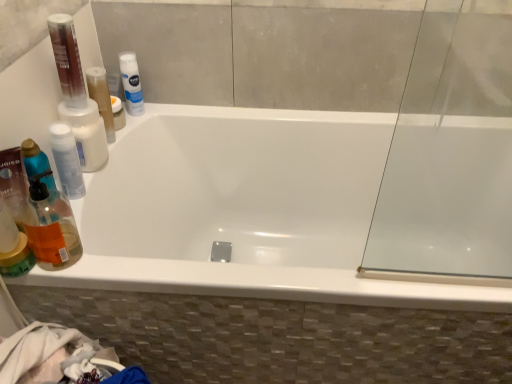
Question: From the image's perspective, is white matte nivea spray at upper center, which is the 3th mouthwash in front-to-back order, above or below white opaque bottle at upper left, which is counted as the second mouthwash, starting from the back?

Choices:
 (A) below
 (B) above

Answer: (B)

Question: Does point (137, 94) appear closer or farther from the camera than point (112, 130)?

Choices:
 (A) closer
 (B) farther

Answer: (B)

Question: Which of these objects is positioned farthest from the white glossy bathtub at center?

Choices:
 (A) white matte nivea spray at upper center, acting as the 1th mouthwash starting from the back
 (B) transparent plastic bottle at left, which ranks as the 3th mouthwash in back-to-front order
 (C) white opaque bottle at upper left, which appears as the second mouthwash when viewed from the front
 (D) translucent orange liquid at left

Answer: (B)

Question: Which object is positioned farthest from the white matte nivea spray at upper center, which is the 3th mouthwash in front-to-back order?

Choices:
 (A) white glossy bathtub at center
 (B) transparent plastic bottle at left, the first mouthwash in the front-to-back sequence
 (C) translucent orange liquid at left
 (D) white opaque bottle at upper left, which appears as the second mouthwash when viewed from the front

Answer: (C)